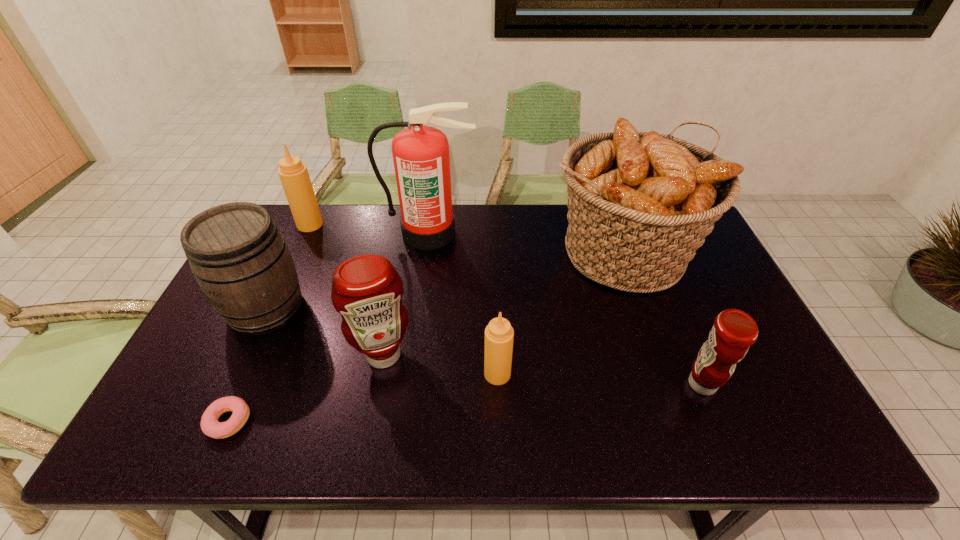
The height and width of the screenshot is (540, 960). Identify the location of blank area in the image that satisfies the following two spatial constraints: 1. on the back side of the third condiment from right to left; 2. on the right side of the basket. 403,251.

Find the location of `free location that satisfies the following two spatial constraints: 1. on the front side of the seventh shortest object; 2. on the right side of the rightmost condiment`. free location that satisfies the following two spatial constraints: 1. on the front side of the seventh shortest object; 2. on the right side of the rightmost condiment is located at coordinates (667, 384).